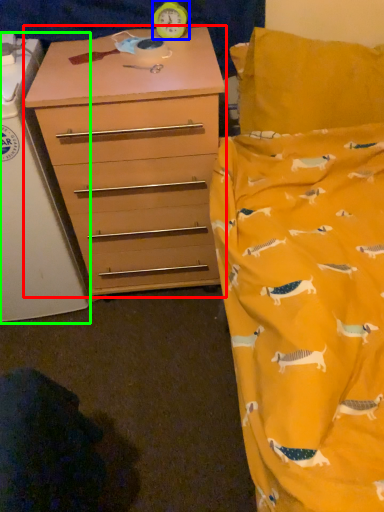
Question: Considering the real-world distances, which object is farthest from chest of drawers (highlighted by a red box)? clock (highlighted by a blue box) or changing table (highlighted by a green box)?

Choices:
 (A) clock
 (B) changing table

Answer: (A)